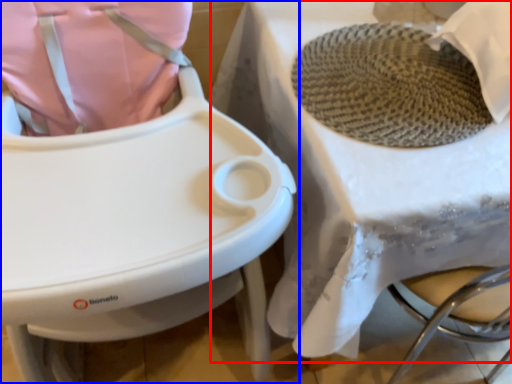
Question: Which object is further to the camera taking this photo, table (highlighted by a red box) or toilet (highlighted by a blue box)?

Choices:
 (A) table
 (B) toilet

Answer: (A)